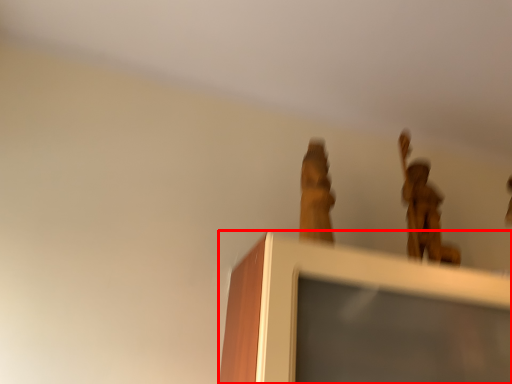
Question: From the image's perspective, where is furniture (annotated by the red box) located relative to bronze statue?

Choices:
 (A) below
 (B) above

Answer: (A)